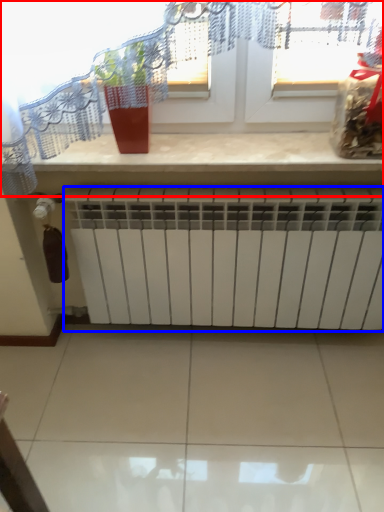
Question: Which object appears farthest to the camera in this image, window (highlighted by a red box) or radiator (highlighted by a blue box)?

Choices:
 (A) window
 (B) radiator

Answer: (B)